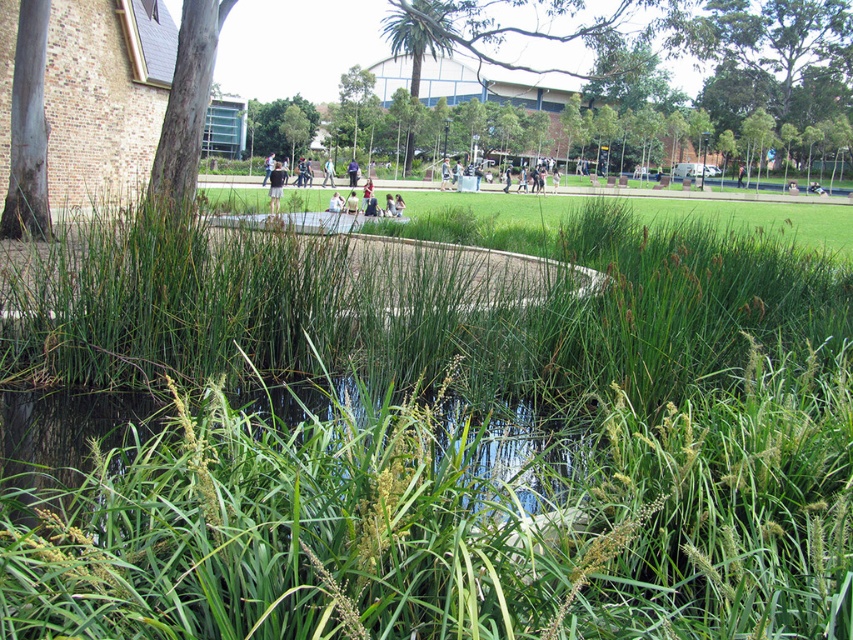
Does dark blue jeans at center have a greater height compared to light brown leather jacket at center?

Yes.

Looking at this image, between dark blue jeans at center and light brown leather jacket at center, which one appears on the right side from the viewer's perspective?

Positioned to the right is dark blue jeans at center.

Image resolution: width=853 pixels, height=640 pixels. I want to click on dark blue jeans at center, so click(x=509, y=163).

Does green grass at center have a smaller size compared to dark blue jeans at center?

Incorrect, green grass at center is not smaller in size than dark blue jeans at center.

Which is more to the right, green grass at center or dark blue jeans at center?

From the viewer's perspective, green grass at center appears more on the right side.

Is point (676, 211) positioned before point (471, 173)?

Yes, point (676, 211) is closer to viewer.

The width and height of the screenshot is (853, 640). In order to click on green grass at center in this screenshot , I will do `click(630, 216)`.

Is point (247, 188) closer to camera compared to point (213, 60)?

No, (247, 188) is behind (213, 60).

Does point (438, 205) lie in front of point (158, 186)?

No, (438, 205) is further to viewer.

Locate an element on the screen. This screenshot has width=853, height=640. green grass at center is located at coordinates (630, 216).